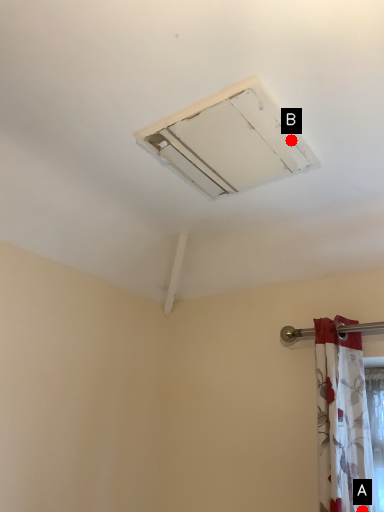
Question: Two points are circled on the image, labeled by A and B beside each circle. Which point is closer to the camera?

Choices:
 (A) A is closer
 (B) B is closer

Answer: (B)